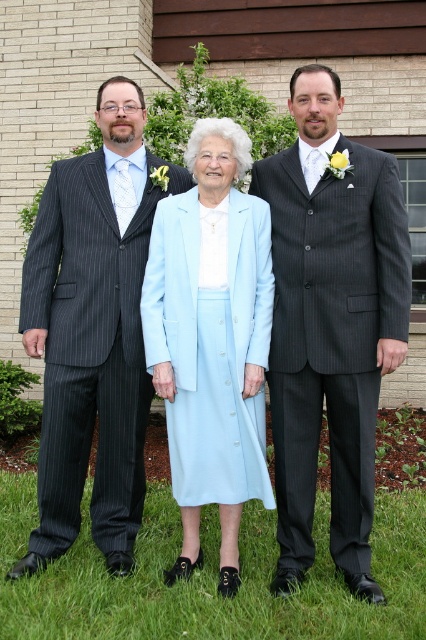
You are standing in the garden and want to walk from point (72, 268) to point (233, 451). Which direction should you move to get closer to your destination?

You should move away from the viewer because point (233, 451) is further away than point (72, 268).

Please generate a question based on the provided information without revealing the specific details in the Objects Description. The question should ask about the position of the dark gray pinstripe suit at center relative to other elements in the scene. Ensure the question mentions all object labels from the Objects section exactly as provided and adheres to the observer perspective.

The dark gray pinstripe suit at center is located at the center of the image based on its 2D coordinates.